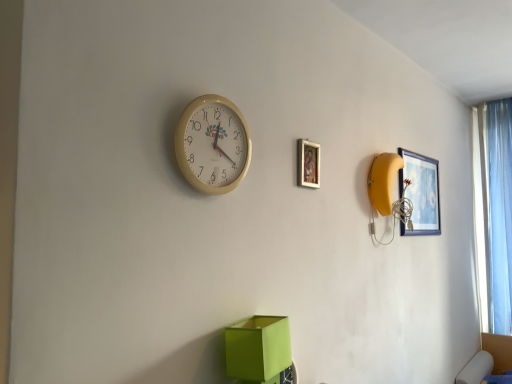
The height and width of the screenshot is (384, 512). What do you see at coordinates (308, 164) in the screenshot? I see `wooden picture frame at upper center, marked as the 1th picture frame in a left-to-right arrangement` at bounding box center [308, 164].

What do you see at coordinates (213, 145) in the screenshot? I see `beige plastic wall clock at upper center` at bounding box center [213, 145].

Where is `green cardboard box at lower center`? The height and width of the screenshot is (384, 512). green cardboard box at lower center is located at coordinates (258, 348).

Find the location of a particular element. matte blue picture frame at upper right, which is the 1th picture frame in back-to-front order is located at coordinates (421, 193).

From a real-world perspective, is wooden picture frame at upper center, positioned as the second picture frame in back-to-front order, located beneath light blue sheer curtain at right?

Incorrect, from a real-world perspective, wooden picture frame at upper center, positioned as the second picture frame in back-to-front order, is higher than light blue sheer curtain at right.

Considering the positions of points (313, 160) and (504, 139), is point (313, 160) farther from camera compared to point (504, 139)?

That is False.

Find the location of `curtain below the wooden picture frame at upper center, marked as the 1th picture frame in a front-to-back arrangement (from a real-world perspective)`. curtain below the wooden picture frame at upper center, marked as the 1th picture frame in a front-to-back arrangement (from a real-world perspective) is located at coordinates (499, 213).

Is wooden picture frame at upper center, marked as the 1th picture frame in a front-to-back arrangement, closer to camera compared to light blue sheer curtain at right?

Yes, the depth of wooden picture frame at upper center, marked as the 1th picture frame in a front-to-back arrangement, is less than that of light blue sheer curtain at right.

Does wooden picture frame at upper center, the 2th picture frame positioned from the right, contain beige plastic wall clock at upper center?

No, beige plastic wall clock at upper center is located outside of wooden picture frame at upper center, the 2th picture frame positioned from the right.

Does wooden picture frame at upper center, marked as the 1th picture frame in a front-to-back arrangement, have a greater width compared to beige plastic wall clock at upper center?

Incorrect, the width of wooden picture frame at upper center, marked as the 1th picture frame in a front-to-back arrangement, does not surpass that of beige plastic wall clock at upper center.

Locate an element on the screen. This screenshot has width=512, height=384. wall clock that is under the wooden picture frame at upper center, marked as the 1th picture frame in a front-to-back arrangement (from a real-world perspective) is located at coordinates (213, 145).

Is point (302, 176) positioned before point (232, 187)?

No, it is behind (232, 187).

Does green cardboard box at lower center have a greater height compared to beige plastic wall clock at upper center?

No, green cardboard box at lower center is not taller than beige plastic wall clock at upper center.

Considering the sizes of green cardboard box at lower center and beige plastic wall clock at upper center in the image, is green cardboard box at lower center wider or thinner than beige plastic wall clock at upper center?

Considering their sizes, green cardboard box at lower center looks broader than beige plastic wall clock at upper center.

Between green cardboard box at lower center and beige plastic wall clock at upper center, which one is positioned behind?

green cardboard box at lower center is further away from the camera.

Between green cardboard box at lower center and beige plastic wall clock at upper center, which one appears on the right side from the viewer's perspective?

green cardboard box at lower center is more to the right.

Which of these two, light blue sheer curtain at right or matte blue picture frame at upper right, the 2th picture frame from the left, is smaller?

matte blue picture frame at upper right, the 2th picture frame from the left.

From the picture: From a real-world perspective, which is physically below, light blue sheer curtain at right or matte blue picture frame at upper right, which is the 1th picture frame in back-to-front order?

From a 3D spatial view, light blue sheer curtain at right is below.

Between light blue sheer curtain at right and matte blue picture frame at upper right, which is the 1th picture frame in back-to-front order, which one appears on the right side from the viewer's perspective?

Positioned to the right is light blue sheer curtain at right.

Is light blue sheer curtain at right positioned with its back to matte blue picture frame at upper right, which is the first picture frame from right to left?

That's not correct — light blue sheer curtain at right is not looking away from matte blue picture frame at upper right, which is the first picture frame from right to left.

Is wooden picture frame at upper center, marked as the 1th picture frame in a left-to-right arrangement, oriented away from matte blue picture frame at upper right, the 2th picture frame from the left?

wooden picture frame at upper center, marked as the 1th picture frame in a left-to-right arrangement, does not have its back to matte blue picture frame at upper right, the 2th picture frame from the left.

Does wooden picture frame at upper center, the 2th picture frame positioned from the right, have a larger size compared to matte blue picture frame at upper right, the 2th picture frame from the left?

Actually, wooden picture frame at upper center, the 2th picture frame positioned from the right, might be smaller than matte blue picture frame at upper right, the 2th picture frame from the left.

Is wooden picture frame at upper center, marked as the 1th picture frame in a front-to-back arrangement, not close to matte blue picture frame at upper right, which is the first picture frame from right to left?

They are positioned close to each other.

Is wooden picture frame at upper center, the 2th picture frame positioned from the right, thinner than matte blue picture frame at upper right, which is the first picture frame from right to left?

Correct, the width of wooden picture frame at upper center, the 2th picture frame positioned from the right, is less than that of matte blue picture frame at upper right, which is the first picture frame from right to left.

In the scene shown: Looking at their sizes, would you say light blue sheer curtain at right is wider or thinner than wooden picture frame at upper center, marked as the 1th picture frame in a left-to-right arrangement?

Considering their sizes, light blue sheer curtain at right looks broader than wooden picture frame at upper center, marked as the 1th picture frame in a left-to-right arrangement.

From the image's perspective, which is below, light blue sheer curtain at right or wooden picture frame at upper center, marked as the 1th picture frame in a front-to-back arrangement?

light blue sheer curtain at right is shown below in the image.

From a real-world perspective, is light blue sheer curtain at right positioned above or below wooden picture frame at upper center, the 2th picture frame positioned from the right?

light blue sheer curtain at right is below wooden picture frame at upper center, the 2th picture frame positioned from the right.

Is light blue sheer curtain at right positioned before wooden picture frame at upper center, marked as the 1th picture frame in a left-to-right arrangement?

No, light blue sheer curtain at right is further to the viewer.

Considering the sizes of beige plastic wall clock at upper center and green cardboard box at lower center in the image, is beige plastic wall clock at upper center taller or shorter than green cardboard box at lower center?

Considering their sizes, beige plastic wall clock at upper center has more height than green cardboard box at lower center.

From a real-world perspective, is beige plastic wall clock at upper center physically below green cardboard box at lower center?

No, from a real-world perspective, beige plastic wall clock at upper center is not beneath green cardboard box at lower center.

Could green cardboard box at lower center be considered to be inside beige plastic wall clock at upper center?

Actually, green cardboard box at lower center is outside beige plastic wall clock at upper center.

From the image's perspective, is beige plastic wall clock at upper center below green cardboard box at lower center?

Incorrect, from the image's perspective, beige plastic wall clock at upper center is higher than green cardboard box at lower center.

This screenshot has height=384, width=512. Find the location of `curtain that appears below the wooden picture frame at upper center, marked as the 1th picture frame in a front-to-back arrangement (from the image's perspective)`. curtain that appears below the wooden picture frame at upper center, marked as the 1th picture frame in a front-to-back arrangement (from the image's perspective) is located at coordinates (499, 213).

Identify the location of wall clock that appears below the wooden picture frame at upper center, positioned as the second picture frame in back-to-front order (from a real-world perspective). The width and height of the screenshot is (512, 384). (213, 145).

Estimate the real-world distances between objects in this image. Which object is closer to green cardboard box at lower center, light blue sheer curtain at right or wooden picture frame at upper center, positioned as the second picture frame in back-to-front order?

Based on the image, wooden picture frame at upper center, positioned as the second picture frame in back-to-front order, appears to be nearer to green cardboard box at lower center.

Considering their positions, is light blue sheer curtain at right positioned further to wooden picture frame at upper center, the 2th picture frame positioned from the right, than matte blue picture frame at upper right, which is the 1th picture frame in back-to-front order?

light blue sheer curtain at right is further to wooden picture frame at upper center, the 2th picture frame positioned from the right.

From the picture: Estimate the real-world distances between objects in this image. Which object is closer to beige plastic wall clock at upper center, wooden picture frame at upper center, the 2th picture frame positioned from the right, or green cardboard box at lower center?

wooden picture frame at upper center, the 2th picture frame positioned from the right, lies closer to beige plastic wall clock at upper center than the other object.

Estimate the real-world distances between objects in this image. Which object is closer to wooden picture frame at upper center, the 2th picture frame positioned from the right, matte blue picture frame at upper right, which is the first picture frame from right to left, or light blue sheer curtain at right?

matte blue picture frame at upper right, which is the first picture frame from right to left, is positioned closer to the anchor wooden picture frame at upper center, the 2th picture frame positioned from the right.

In the scene shown: Considering their positions, is wooden picture frame at upper center, the 2th picture frame positioned from the right, positioned further to beige plastic wall clock at upper center than matte blue picture frame at upper right, which is the 1th picture frame in back-to-front order?

The object further to beige plastic wall clock at upper center is matte blue picture frame at upper right, which is the 1th picture frame in back-to-front order.

From the image, which object appears to be nearer to green cardboard box at lower center, matte blue picture frame at upper right, which is the first picture frame from right to left, or light blue sheer curtain at right?

The object closer to green cardboard box at lower center is matte blue picture frame at upper right, which is the first picture frame from right to left.

Considering their positions, is beige plastic wall clock at upper center positioned closer to green cardboard box at lower center than light blue sheer curtain at right?

Among the two, beige plastic wall clock at upper center is located nearer to green cardboard box at lower center.

Which object lies further to the anchor point matte blue picture frame at upper right, which is the first picture frame from right to left, light blue sheer curtain at right or green cardboard box at lower center?

Among the two, green cardboard box at lower center is located further to matte blue picture frame at upper right, which is the first picture frame from right to left.

Where is `picture frame between green cardboard box at lower center and matte blue picture frame at upper right, the 2th picture frame from the left, from front to back`? Image resolution: width=512 pixels, height=384 pixels. picture frame between green cardboard box at lower center and matte blue picture frame at upper right, the 2th picture frame from the left, from front to back is located at coordinates (308, 164).

Identify the location of picture frame between wooden picture frame at upper center, the 2th picture frame positioned from the right, and light blue sheer curtain at right. This screenshot has height=384, width=512. (421, 193).

Where is `cardboard box situated between beige plastic wall clock at upper center and light blue sheer curtain at right from left to right`? Image resolution: width=512 pixels, height=384 pixels. cardboard box situated between beige plastic wall clock at upper center and light blue sheer curtain at right from left to right is located at coordinates (258, 348).

The width and height of the screenshot is (512, 384). I want to click on cardboard box positioned between beige plastic wall clock at upper center and matte blue picture frame at upper right, which is the 1th picture frame in back-to-front order, from near to far, so click(258, 348).